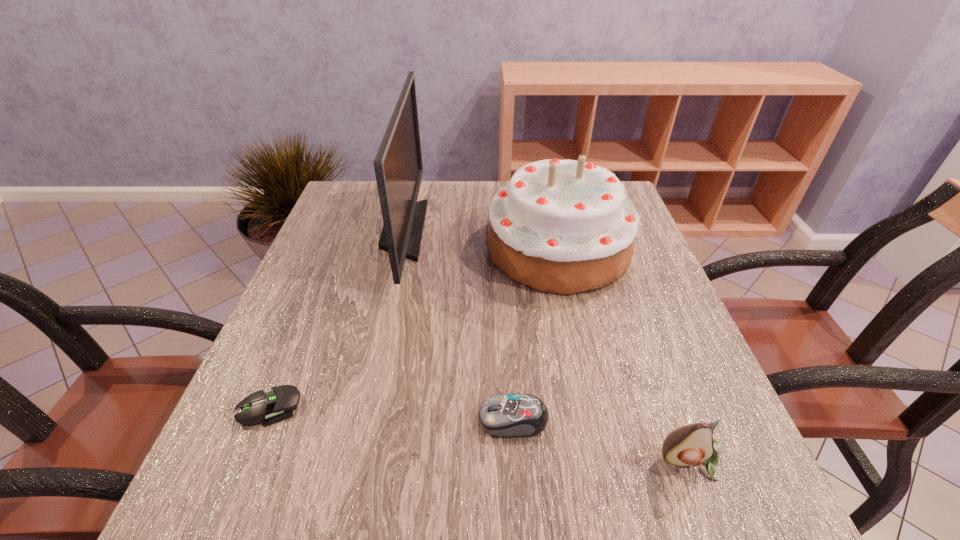
The width and height of the screenshot is (960, 540). In order to click on the tallest object in this screenshot , I will do `click(398, 166)`.

Locate an element on the screen. This screenshot has width=960, height=540. monitor is located at coordinates (398, 166).

Where is `cake`? The width and height of the screenshot is (960, 540). cake is located at coordinates (560, 226).

Image resolution: width=960 pixels, height=540 pixels. I want to click on the third shortest object, so click(693, 444).

The width and height of the screenshot is (960, 540). Find the location of `avocado`. avocado is located at coordinates (693, 444).

Identify the location of the right computer mouse. The image size is (960, 540). (502, 415).

In order to click on the taller computer mouse in this screenshot , I will do `click(502, 415)`.

The height and width of the screenshot is (540, 960). I want to click on the left computer mouse, so click(272, 406).

Where is `the shortest object`? The width and height of the screenshot is (960, 540). the shortest object is located at coordinates (272, 406).

Locate an element on the screen. This screenshot has height=540, width=960. blank space located 0.320m on the screen side of the tallest object is located at coordinates (549, 231).